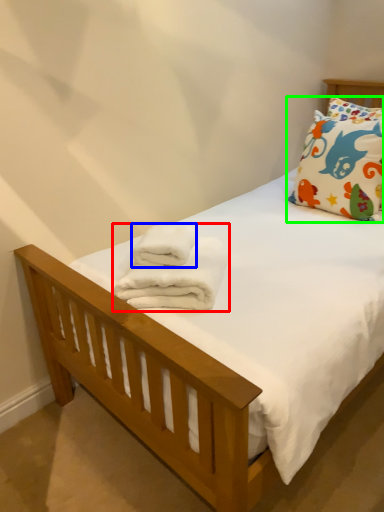
Question: Based on their relative distances, which object is farther from bath towel (highlighted by a red box)? Choose from bath towel (highlighted by a blue box) and pillow (highlighted by a green box).

Choices:
 (A) bath towel
 (B) pillow

Answer: (B)